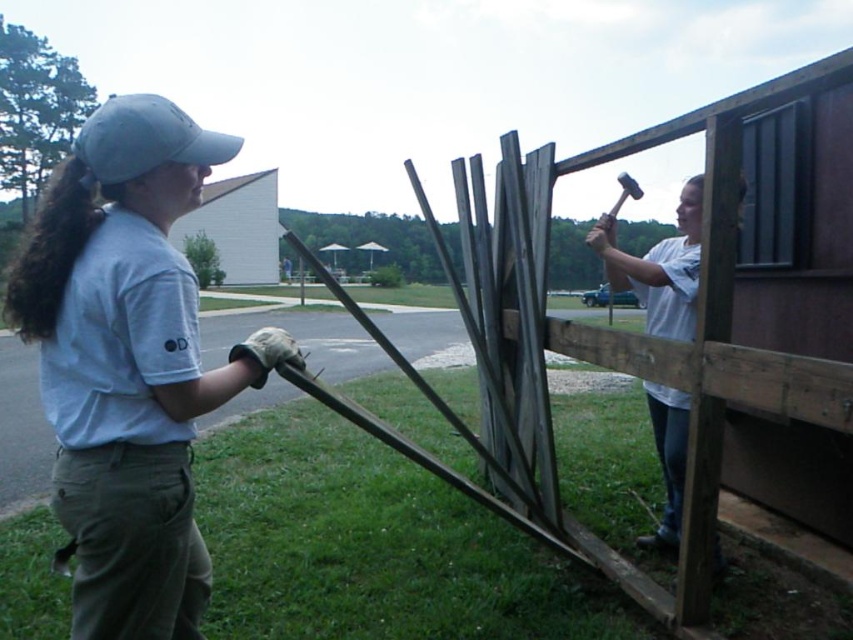
You are standing at the origin point of the coordinate system. You see two points, point (x=699, y=228) and point (x=148, y=147). Which point is closer to you?

Point (x=148, y=147) is closer to you because it is in front of point (x=699, y=228).

You are a construction worker observing two people working on a wooden frame structure. You notice the light gray cotton cap at upper left and the gray fabric baseball cap at upper left. Which cap is positioned more to the right?

The light gray cotton cap at upper left is positioned more to the right than the gray fabric baseball cap at upper left.